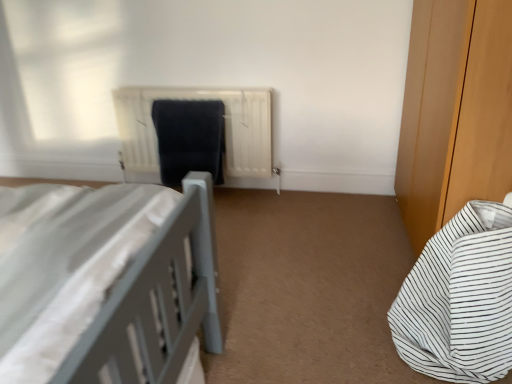
Question: Is there a large distance between white striped fabric bed at lower right and white matte radiator at center?

Choices:
 (A) yes
 (B) no

Answer: (A)

Question: Is white striped fabric bed at lower right oriented away from white matte radiator at center?

Choices:
 (A) no
 (B) yes

Answer: (A)

Question: Considering the relative sizes of white striped fabric bed at lower right and white matte radiator at center in the image provided, is white striped fabric bed at lower right taller than white matte radiator at center?

Choices:
 (A) yes
 (B) no

Answer: (B)

Question: Does white striped fabric bed at lower right have a larger size compared to white matte radiator at center?

Choices:
 (A) yes
 (B) no

Answer: (B)

Question: From a real-world perspective, is white striped fabric bed at lower right located beneath white matte radiator at center?

Choices:
 (A) no
 (B) yes

Answer: (B)

Question: In terms of height, does white striped fabric bed at lower right look taller or shorter compared to white matte radiator at center?

Choices:
 (A) tall
 (B) short

Answer: (B)

Question: In the image, is white striped fabric bed at lower right on the left side or the right side of white matte radiator at center?

Choices:
 (A) left
 (B) right

Answer: (B)

Question: From a real-world perspective, is white striped fabric bed at lower right above or below white matte radiator at center?

Choices:
 (A) above
 (B) below

Answer: (B)

Question: In terms of size, does white striped fabric bed at lower right appear bigger or smaller than white matte radiator at center?

Choices:
 (A) big
 (B) small

Answer: (B)

Question: Is matte black laundry at center bigger or smaller than white matte radiator at center?

Choices:
 (A) small
 (B) big

Answer: (A)

Question: Is matte black laundry at center to the left or to the right of white matte radiator at center in the image?

Choices:
 (A) left
 (B) right

Answer: (A)

Question: Is point (201, 140) positioned closer to the camera than point (228, 94)?

Choices:
 (A) farther
 (B) closer

Answer: (A)

Question: Considering the positions of matte black laundry at center and white matte radiator at center in the image, is matte black laundry at center wider or thinner than white matte radiator at center?

Choices:
 (A) thin
 (B) wide

Answer: (A)

Question: Would you say white matte radiator at center is to the left or to the right of white striped fabric bed at lower right in the picture?

Choices:
 (A) right
 (B) left

Answer: (B)

Question: From a real-world perspective, is white matte radiator at center positioned above or below white striped fabric bed at lower right?

Choices:
 (A) above
 (B) below

Answer: (A)